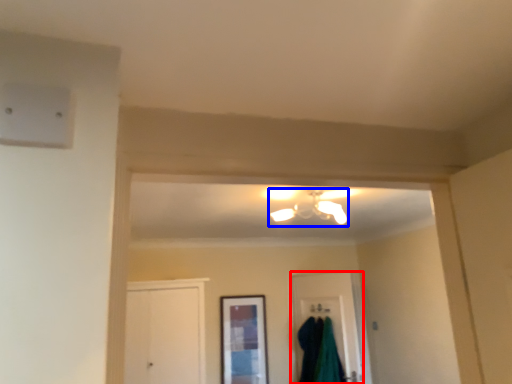
Question: Which point is closer to the camera, door (highlighted by a red box) or light fixture (highlighted by a blue box)?

Choices:
 (A) door
 (B) light fixture

Answer: (B)